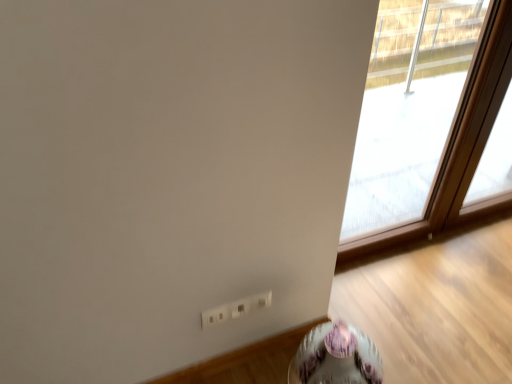
Question: Can you confirm if transparent glass window at upper right is shorter than porcelain floral-patterned table at lower right?

Choices:
 (A) no
 (B) yes

Answer: (A)

Question: From a real-world perspective, is transparent glass window at upper right beneath porcelain floral-patterned table at lower right?

Choices:
 (A) no
 (B) yes

Answer: (A)

Question: From a real-world perspective, is transparent glass window at upper right physically above porcelain floral-patterned table at lower right?

Choices:
 (A) yes
 (B) no

Answer: (A)

Question: Can we say transparent glass window at upper right lies outside porcelain floral-patterned table at lower right?

Choices:
 (A) yes
 (B) no

Answer: (A)

Question: Could porcelain floral-patterned table at lower right be considered to be inside transparent glass window at upper right?

Choices:
 (A) yes
 (B) no

Answer: (B)

Question: From the image's perspective, would you say transparent glass window at upper right is shown under porcelain floral-patterned table at lower right?

Choices:
 (A) no
 (B) yes

Answer: (A)

Question: Does porcelain floral-patterned table at lower right touch transparent glass window at upper right?

Choices:
 (A) no
 (B) yes

Answer: (A)

Question: Considering the relative positions of porcelain floral-patterned table at lower right and transparent glass window at upper right in the image provided, is porcelain floral-patterned table at lower right to the left of transparent glass window at upper right from the viewer's perspective?

Choices:
 (A) yes
 (B) no

Answer: (A)

Question: From a real-world perspective, is porcelain floral-patterned table at lower right on top of transparent glass window at upper right?

Choices:
 (A) yes
 (B) no

Answer: (B)

Question: Does porcelain floral-patterned table at lower right lie behind transparent glass window at upper right?

Choices:
 (A) no
 (B) yes

Answer: (A)

Question: Would you say transparent glass window at upper right is part of porcelain floral-patterned table at lower right's contents?

Choices:
 (A) yes
 (B) no

Answer: (B)

Question: Does porcelain floral-patterned table at lower right turn towards transparent glass window at upper right?

Choices:
 (A) yes
 (B) no

Answer: (B)

Question: In terms of height, does transparent glass window at upper right look taller or shorter compared to porcelain floral-patterned table at lower right?

Choices:
 (A) tall
 (B) short

Answer: (A)